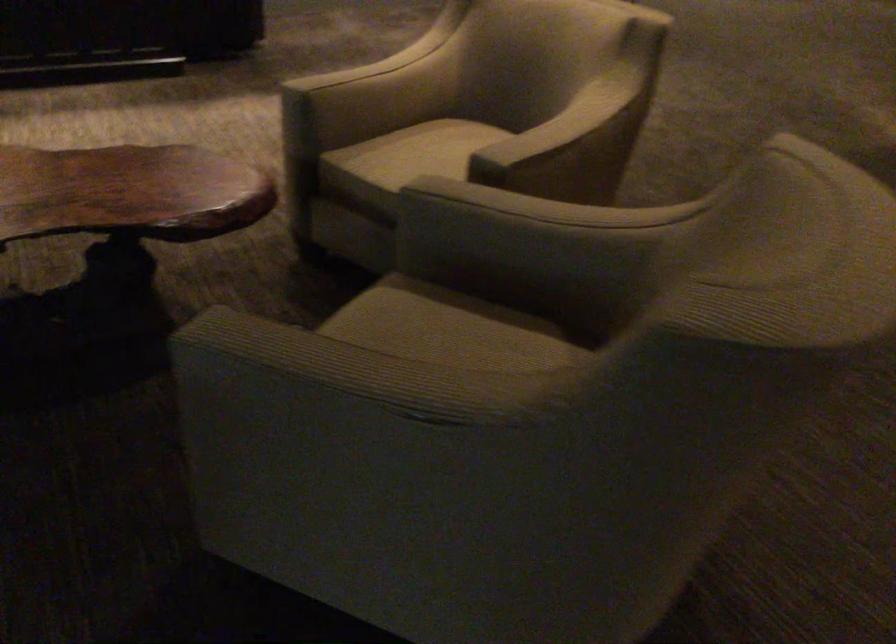
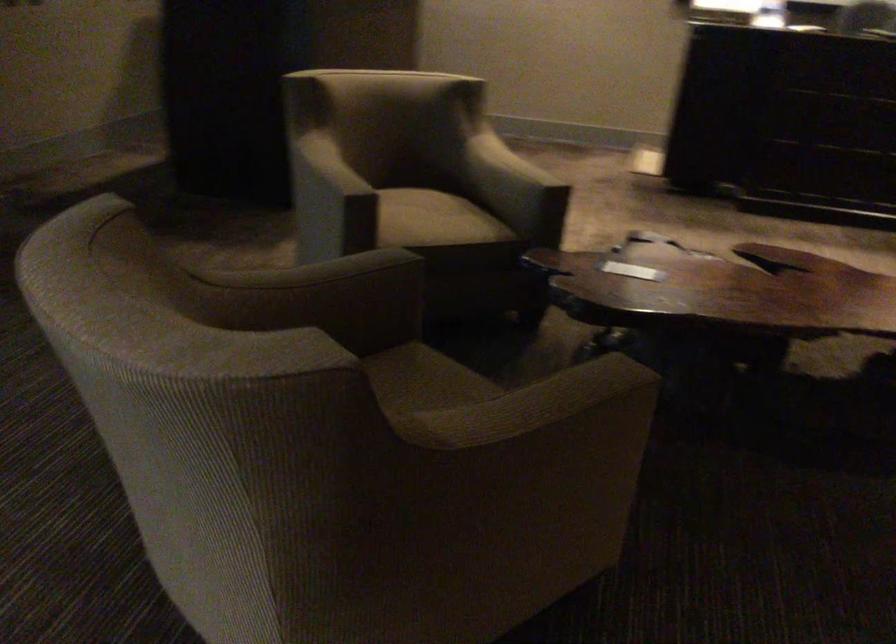
Question: The images are taken continuously from a first-person perspective. In which direction is your viewpoint rotating?

Choices:
 (A) Left
 (B) Right
 (C) Up
 (D) Down

Answer: (A)